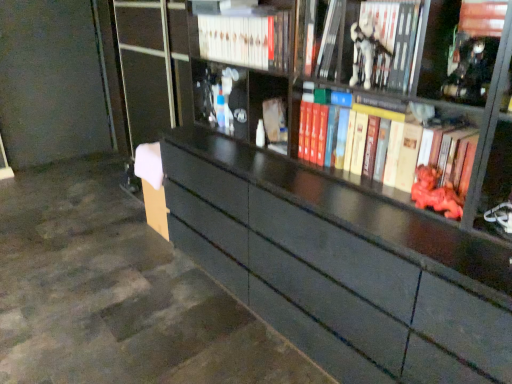
What do you see at coordinates (246, 40) in the screenshot?
I see `white glossy book at upper center, which is the fourth book in right-to-left order` at bounding box center [246, 40].

Where is `hardcover book at upper center, the 2th book from the left`? hardcover book at upper center, the 2th book from the left is located at coordinates (324, 40).

The image size is (512, 384). What do you see at coordinates (324, 40) in the screenshot?
I see `hardcover book at upper center, the 2th book from the left` at bounding box center [324, 40].

What do you see at coordinates (275, 120) in the screenshot? I see `matte white book at center` at bounding box center [275, 120].

This screenshot has height=384, width=512. What do you see at coordinates (461, 49) in the screenshot?
I see `metallic silver statue at upper right` at bounding box center [461, 49].

Describe the element at coordinates (435, 193) in the screenshot. This screenshot has height=384, width=512. I see `matte red statue at right, which ranks as the first toy in right-to-left order` at that location.

This screenshot has width=512, height=384. Identify the location of white matte figurine at upper center, the 2th book from the right. (370, 44).

You are a GUI agent. You are given a task and a screenshot of the screen. Output one action in this format:
    pyautogui.click(x=<x>, y=<y>)
    Task: Click on the white glossy book at upper center, which is the fourth book in right-to-left order
    Image resolution: width=512 pixels, height=384 pixels.
    Given the screenshot: What is the action you would take?
    pyautogui.click(x=246, y=40)

Which is more to the left, hardcover book at upper center, the 2th book from the left, or white glossy book at upper center, which appears as the first book when viewed from the left?

white glossy book at upper center, which appears as the first book when viewed from the left, is more to the left.

In the scene shown: Is hardcover book at upper center, the 2th book from the left, in contact with white glossy book at upper center, which appears as the first book when viewed from the left?

hardcover book at upper center, the 2th book from the left, is not next to white glossy book at upper center, which appears as the first book when viewed from the left, and they're not touching.

From a real-world perspective, between hardcover book at upper center, the 2th book from the left, and white glossy book at upper center, which is the fourth book in right-to-left order, who is vertically lower?

In real-world perspective, white glossy book at upper center, which is the fourth book in right-to-left order, is lower.

Who is bigger, hardcover book at upper center, the 2th book from the left, or matte white book at center?

hardcover book at upper center, the 2th book from the left.

Is hardcover book at upper center, acting as the third book starting from the right, beside matte white book at center?

hardcover book at upper center, acting as the third book starting from the right, and matte white book at center are clearly separated.

Does hardcover book at upper center, the 2th book from the left, have a lesser height compared to matte white book at center?

No, hardcover book at upper center, the 2th book from the left, is not shorter than matte white book at center.

Considering the points (333, 48) and (281, 98), which point is behind, point (333, 48) or point (281, 98)?

The point (281, 98) is farther.

From the image's perspective, between white matte figurine at upper center, arranged as the 2th toy when viewed from the right, and matte white book at center, which one is located above?

white matte figurine at upper center, arranged as the 2th toy when viewed from the right, is shown above in the image.

Where is `toy located above the matte white book at center (from a real-world perspective)`? The image size is (512, 384). toy located above the matte white book at center (from a real-world perspective) is located at coordinates (366, 50).

Based on their sizes in the image, would you say white matte figurine at upper center, which is counted as the 1th toy, starting from the left, is bigger or smaller than matte white book at center?

Clearly, white matte figurine at upper center, which is counted as the 1th toy, starting from the left, is larger in size than matte white book at center.

Considering the relative sizes of white matte figurine at upper center, which is counted as the 1th toy, starting from the left, and matte white book at center in the image provided, is white matte figurine at upper center, which is counted as the 1th toy, starting from the left, wider than matte white book at center?

Incorrect, the width of white matte figurine at upper center, which is counted as the 1th toy, starting from the left, does not surpass that of matte white book at center.

Which is in front, white matte figurine at upper center, the 3th book in the left-to-right sequence, or white glossy book at upper center, which appears as the first book when viewed from the left?

white matte figurine at upper center, the 3th book in the left-to-right sequence.

Can you confirm if white matte figurine at upper center, the 3th book in the left-to-right sequence, is smaller than white glossy book at upper center, which appears as the first book when viewed from the left?

Yes.

Are white matte figurine at upper center, the 3th book in the left-to-right sequence, and white glossy book at upper center, which appears as the first book when viewed from the left, far apart?

That's not correct — white matte figurine at upper center, the 3th book in the left-to-right sequence, is a little close to white glossy book at upper center, which appears as the first book when viewed from the left.

Is white matte figurine at upper center, the 3th book in the left-to-right sequence, situated inside white glossy book at upper center, which is the fourth book in right-to-left order, or outside?

white matte figurine at upper center, the 3th book in the left-to-right sequence, is located beyond the bounds of white glossy book at upper center, which is the fourth book in right-to-left order.

Is white matte figurine at upper center, marked as the 1th toy in a top-to-bottom arrangement, located within metallic silver statue at upper right?

No, metallic silver statue at upper right does not contain white matte figurine at upper center, marked as the 1th toy in a top-to-bottom arrangement.

From a real-world perspective, is metallic silver statue at upper right located beneath white matte figurine at upper center, arranged as the 2th toy when viewed from the right?

Actually, metallic silver statue at upper right is physically above white matte figurine at upper center, arranged as the 2th toy when viewed from the right, in the real world.

Between metallic silver statue at upper right and white matte figurine at upper center, arranged as the 2th toy when viewed from the right, which one has less height?

With less height is white matte figurine at upper center, arranged as the 2th toy when viewed from the right.

Could you tell me if metallic silver statue at upper right is facing white matte figurine at upper center, which ranks as the 2th toy in bottom-to-top order?

No, metallic silver statue at upper right is not turned towards white matte figurine at upper center, which ranks as the 2th toy in bottom-to-top order.

Considering the relative sizes of hardcover book at upper center, the 2th book from the left, and white matte figurine at upper center, arranged as the 2th toy when viewed from the right, in the image provided, is hardcover book at upper center, the 2th book from the left, smaller than white matte figurine at upper center, arranged as the 2th toy when viewed from the right,?

No.

From the picture: Is white matte figurine at upper center, which is counted as the 1th toy, starting from the left, at the back of hardcover book at upper center, the 2th book from the left?

No, hardcover book at upper center, the 2th book from the left,'s orientation is not away from white matte figurine at upper center, which is counted as the 1th toy, starting from the left.

From the image's perspective, which object appears higher, hardcover book at upper center, the 2th book from the left, or white matte figurine at upper center, marked as the 1th toy in a top-to-bottom arrangement?

From the image's view, hardcover book at upper center, the 2th book from the left, is above.

Considering the points (321, 4) and (366, 38), which point is behind, point (321, 4) or point (366, 38)?

The point (321, 4) is farther.

From the metallic silver statue at upper right, count the 3rd book to the left and point to it. Please provide its 2D coordinates.

[(324, 40)]

From a real-world perspective, who is located higher, hardcover book at upper center, acting as the third book starting from the right, or metallic silver statue at upper right?

From a 3D spatial view, metallic silver statue at upper right is above.

Considering the positions of objects hardcover book at upper center, acting as the third book starting from the right, and metallic silver statue at upper right in the image provided, who is in front, hardcover book at upper center, acting as the third book starting from the right, or metallic silver statue at upper right?

metallic silver statue at upper right is more forward.

How far apart are hardcover book at upper center, acting as the third book starting from the right, and metallic silver statue at upper right?

They are 16.31 inches apart.

Find the location of a particular element. The image size is (512, 384). book located on the left of hardcover book at upper center, acting as the third book starting from the right is located at coordinates (246, 40).

Locate an element on the screen. paperback book below the hardcover book at upper center, the 2th book from the left (from a real-world perspective) is located at coordinates (275, 120).

When comparing their distances from white glossy book at upper center, which is the fourth book in right-to-left order, does metallic silver statue at upper right or matte white book at center seem closer?

Based on the image, matte white book at center appears to be nearer to white glossy book at upper center, which is the fourth book in right-to-left order.

Considering their positions, is white glossy book at upper center, which appears as the first book when viewed from the left, positioned closer to metallic silver statue at upper right than white matte figurine at upper center, which ranks as the 2th toy in bottom-to-top order?

white matte figurine at upper center, which ranks as the 2th toy in bottom-to-top order, is positioned closer to the anchor metallic silver statue at upper right.

Estimate the real-world distances between objects in this image. Which object is further from hardcover book at upper center, acting as the third book starting from the right, white glossy book at upper center, which is the fourth book in right-to-left order, or metallic silver statue at upper right?

metallic silver statue at upper right.

When comparing their distances from white matte figurine at upper center, which ranks as the 2th toy in bottom-to-top order, does matte red statue at right, which is counted as the 1th toy, starting from the bottom, or hardcover book at upper center, the 2th book from the left, seem further?

matte red statue at right, which is counted as the 1th toy, starting from the bottom.

Based on their spatial positions, is white matte figurine at upper center, which ranks as the 2th toy in bottom-to-top order, or white matte figurine at upper center, the 3th book in the left-to-right sequence, closer to white glossy book at upper center, which appears as the first book when viewed from the left?

white matte figurine at upper center, the 3th book in the left-to-right sequence, is closer to white glossy book at upper center, which appears as the first book when viewed from the left.

Estimate the real-world distances between objects in this image. Which object is closer to matte white book at center, hardcover book at upper center, the 2th book from the left, or metallic silver statue at upper right?

hardcover book at upper center, the 2th book from the left, is closer to matte white book at center.

Based on their spatial positions, is hardcover book at upper center, the 2th book from the left, or matte white book at center closer to white matte figurine at upper center, the 3th book in the left-to-right sequence?

hardcover book at upper center, the 2th book from the left, is positioned closer to the anchor white matte figurine at upper center, the 3th book in the left-to-right sequence.

Estimate the real-world distances between objects in this image. Which object is further from matte white book at center, matte red statue at right, which ranks as the first toy in right-to-left order, or red matte book at upper right, the 1th book from the right?

Based on the image, matte red statue at right, which ranks as the first toy in right-to-left order, appears to be further to matte white book at center.

The image size is (512, 384). In order to click on cabinet between hardcover book at upper center, acting as the third book starting from the right, and matte red statue at right, marked as the 2th toy in a left-to-right arrangement, in the up-down direction in this screenshot , I will do `click(461, 49)`.

I want to click on cabinet that lies between white matte figurine at upper center, arranged as the 2th toy when viewed from the right, and red matte book at upper right, the fourth book from the left, from top to bottom, so click(461, 49).

Where is `cabinet between hardcover book at upper center, the 2th book from the left, and red matte book at upper right, the fourth book from the left, from top to bottom`? This screenshot has width=512, height=384. cabinet between hardcover book at upper center, the 2th book from the left, and red matte book at upper right, the fourth book from the left, from top to bottom is located at coordinates (461, 49).

Image resolution: width=512 pixels, height=384 pixels. Identify the location of toy between white matte figurine at upper center, the 3th book in the left-to-right sequence, and matte red statue at right, marked as the 2th toy in a left-to-right arrangement, from top to bottom. (366, 50).